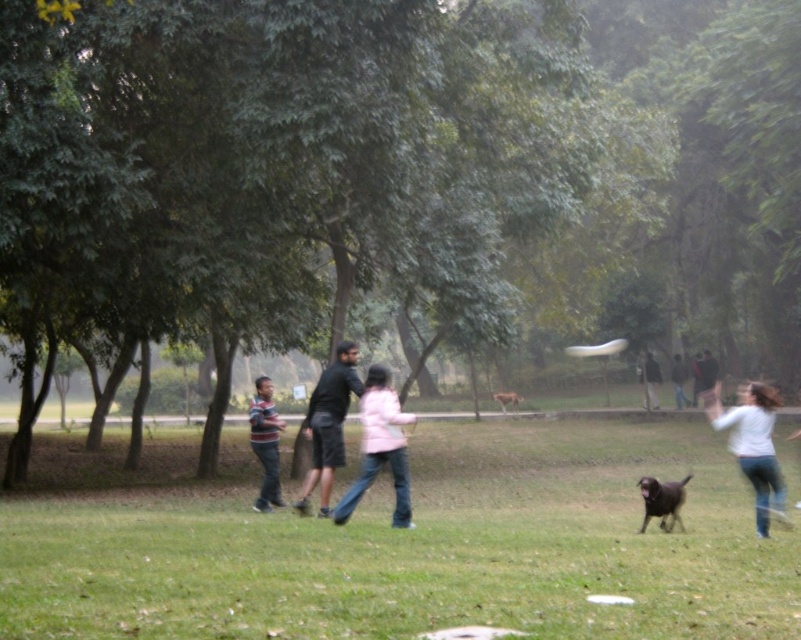
Question: Which point is closer to the camera?

Choices:
 (A) dark gray sweater at center
 (B) light blue jeans at center
 (C) striped cotton shirt at center
 (D) pink matte jacket at center

Answer: (D)

Question: Which object appears farthest from the camera in this image?

Choices:
 (A) dark gray sweater at center
 (B) white plastic frisbee at center

Answer: (A)

Question: Does pink matte jacket at center appear on the right side of light blue jeans at lower right?

Choices:
 (A) yes
 (B) no

Answer: (B)

Question: Among these points, which one is farthest from the camera?

Choices:
 (A) (699, 515)
 (B) (641, 369)

Answer: (B)

Question: Observing the image, what is the correct spatial positioning of white matte shirt at right in reference to white plastic frisbee at center?

Choices:
 (A) above
 (B) below

Answer: (B)

Question: Is green grass at center smaller than brown furry dog at center?

Choices:
 (A) yes
 (B) no

Answer: (B)